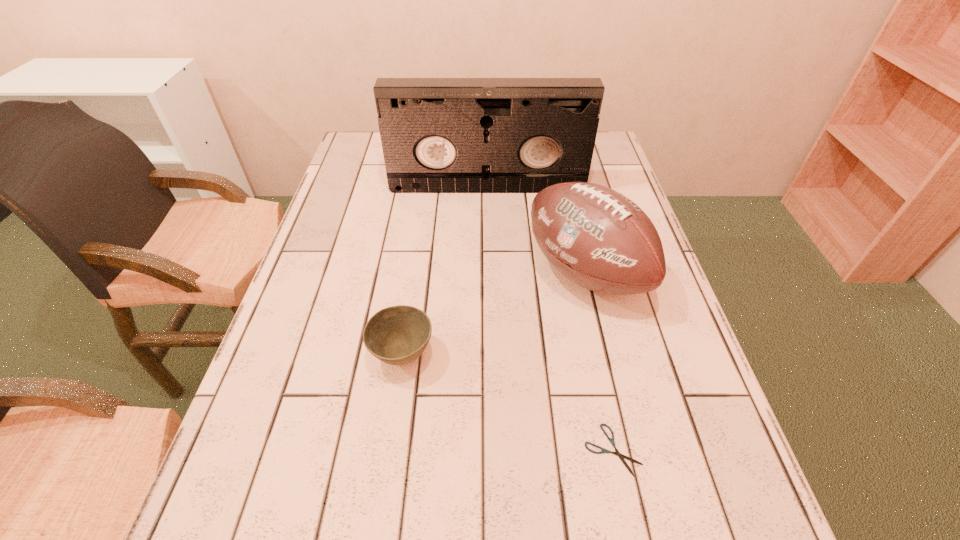
Find the location of a particular element. The width and height of the screenshot is (960, 540). free space located 0.080m on the right of the bowl is located at coordinates (474, 355).

Where is `free space located on the back of the nearest object`? free space located on the back of the nearest object is located at coordinates (592, 354).

The height and width of the screenshot is (540, 960). I want to click on videotape situated at the right edge, so click(439, 135).

Where is `football (American) that is positioned at the right edge`? This screenshot has width=960, height=540. football (American) that is positioned at the right edge is located at coordinates (598, 238).

At what (x,y) coordinates should I click in order to perform the action: click on shears situated at the right edge. Please return your answer as a coordinate pair (x, y). Image resolution: width=960 pixels, height=540 pixels. Looking at the image, I should click on 621,456.

The width and height of the screenshot is (960, 540). Identify the location of blank space at the left edge. click(311, 312).

Locate an element on the screen. The image size is (960, 540). vacant region at the right edge of the desktop is located at coordinates (611, 319).

The height and width of the screenshot is (540, 960). I want to click on vacant area at the far right corner of the desktop, so click(x=605, y=140).

Where is `vacant area between the tallest object and the second nearest object`? vacant area between the tallest object and the second nearest object is located at coordinates (445, 271).

This screenshot has width=960, height=540. In order to click on vacant space that's between the tallest object and the third farthest object in this screenshot , I will do `click(445, 271)`.